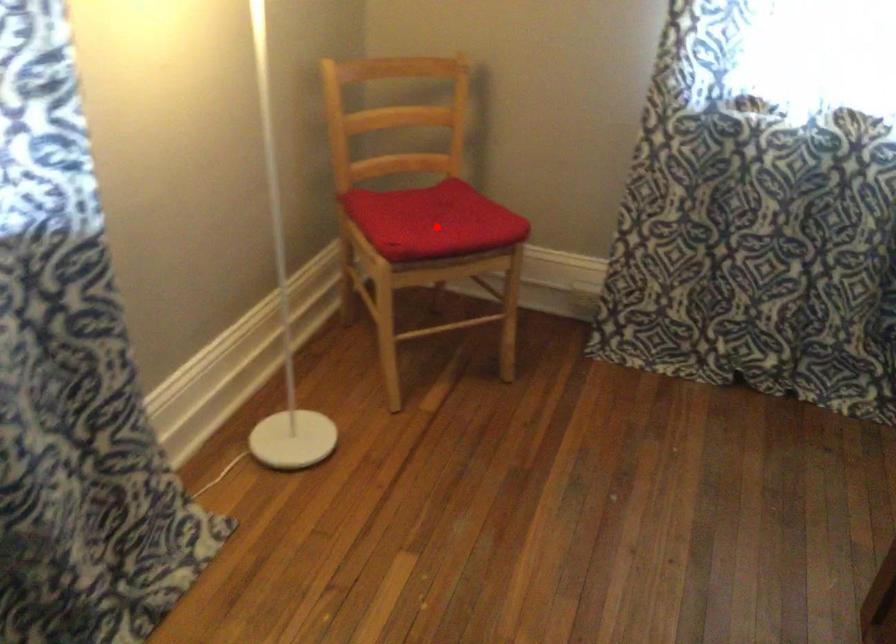
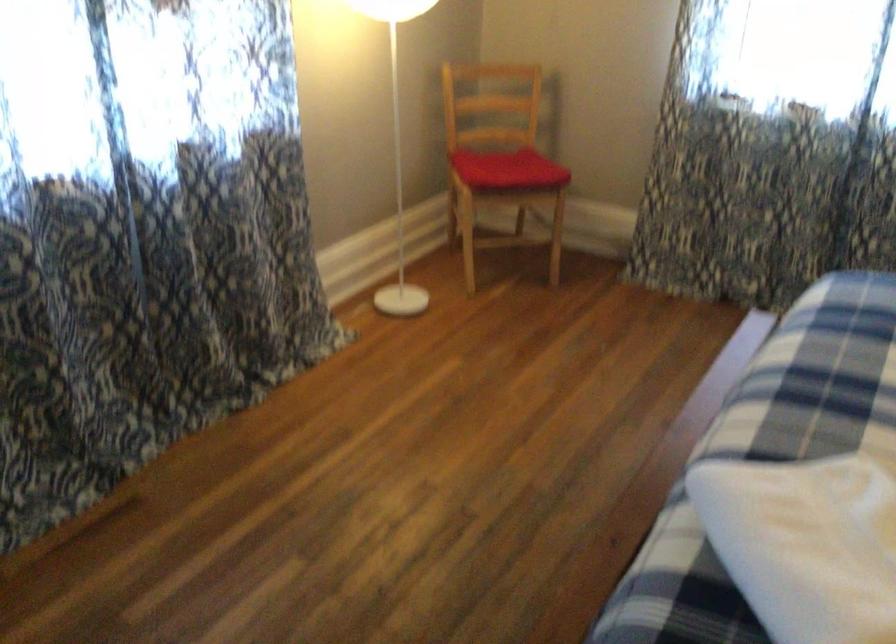
In the second image, find the point that corresponds to the highlighted location in the first image.

(507, 169)